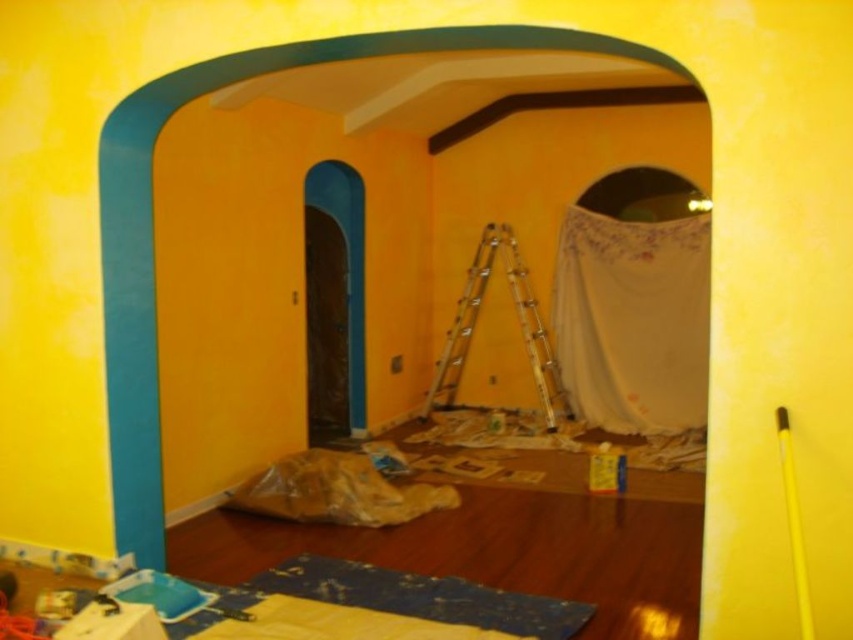
Question: Which point is farther to the camera?

Choices:
 (A) metallic silver ladder at center
 (B) white lace curtain at center

Answer: (A)

Question: Where is white lace curtain at center located in relation to metallic silver ladder at center in the image?

Choices:
 (A) right
 (B) left

Answer: (A)

Question: Is white lace curtain at center smaller than metallic silver ladder at center?

Choices:
 (A) yes
 (B) no

Answer: (A)

Question: Which of the following is the closest to the observer?

Choices:
 (A) pos(627,323)
 (B) pos(463,356)

Answer: (A)

Question: Among these objects, which one is nearest to the camera?

Choices:
 (A) metallic silver ladder at center
 (B) white lace curtain at center

Answer: (B)

Question: Does white lace curtain at center appear on the left side of metallic silver ladder at center?

Choices:
 (A) no
 (B) yes

Answer: (A)